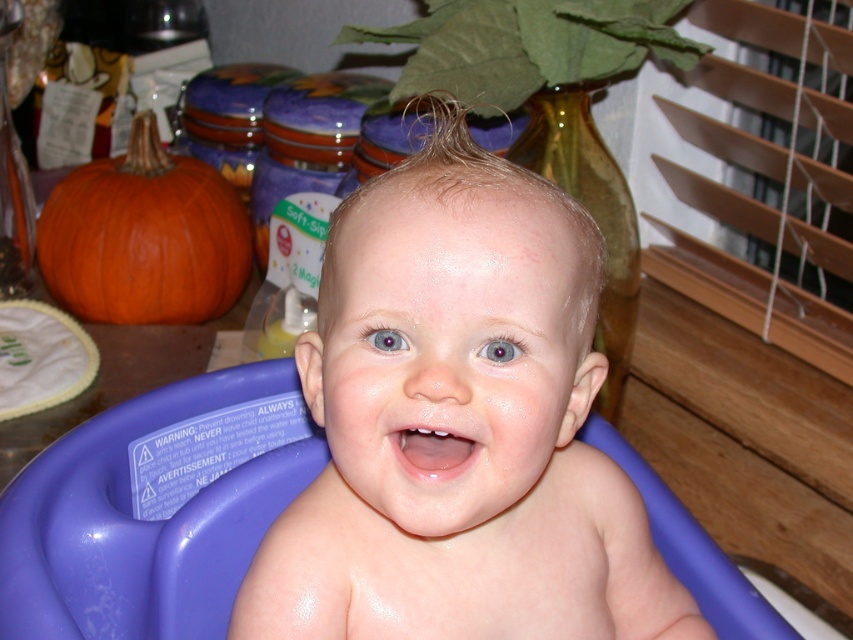
Can you confirm if purple plastic bath at center is thinner than orange matte pumpkin at left?

Yes.

Locate an element on the screen. This screenshot has height=640, width=853. purple plastic bath at center is located at coordinates (154, 509).

Identify the location of purple plastic bath at center. Image resolution: width=853 pixels, height=640 pixels. (154, 509).

Who is more distant from viewer, (x=547, y=516) or (x=221, y=214)?

Point (x=221, y=214)

Who is more forward, (x=375, y=561) or (x=207, y=204)?

Point (x=375, y=561) is in front.

I want to click on smooth skin baby at center, so click(x=459, y=426).

Between point (376, 208) and point (210, 477), which one is positioned in front?

Point (376, 208) is in front.

The width and height of the screenshot is (853, 640). What do you see at coordinates (459, 426) in the screenshot? I see `smooth skin baby at center` at bounding box center [459, 426].

At what (x,y) coordinates should I click in order to perform the action: click on smooth skin baby at center. Please return your answer as a coordinate pair (x, y). The width and height of the screenshot is (853, 640). Looking at the image, I should click on (459, 426).